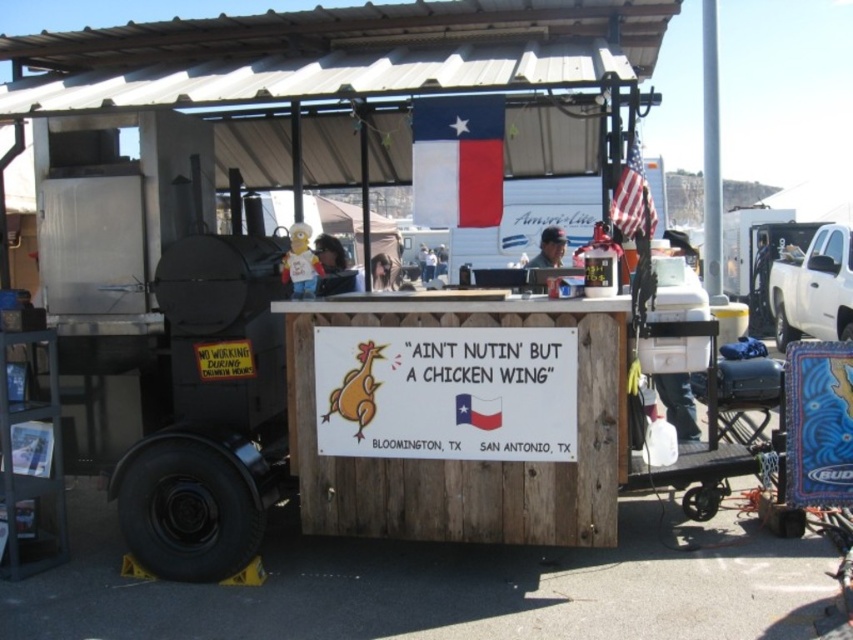
Question: Does texas flag at center have a greater width compared to white plastic cooler at right?

Choices:
 (A) yes
 (B) no

Answer: (B)

Question: Which point is farther to the camera?

Choices:
 (A) texas flag at center
 (B) dark brown leather jacket at center
 (C) american flag at upper right
 (D) wooden signboard at center

Answer: (B)

Question: Among these objects, which one is nearest to the camera?

Choices:
 (A) dark gray fabric cap at center
 (B) white wood sign at center
 (C) texas flag at center
 (D) american flag at upper right

Answer: (C)

Question: Can you confirm if texas flag at center is thinner than american flag at upper right?

Choices:
 (A) no
 (B) yes

Answer: (A)

Question: Does white wood sign at center appear over wooden signboard at center?

Choices:
 (A) yes
 (B) no

Answer: (B)

Question: Which of the following is the closest to the observer?

Choices:
 (A) dark gray fabric cap at center
 (B) american flag at upper right

Answer: (B)